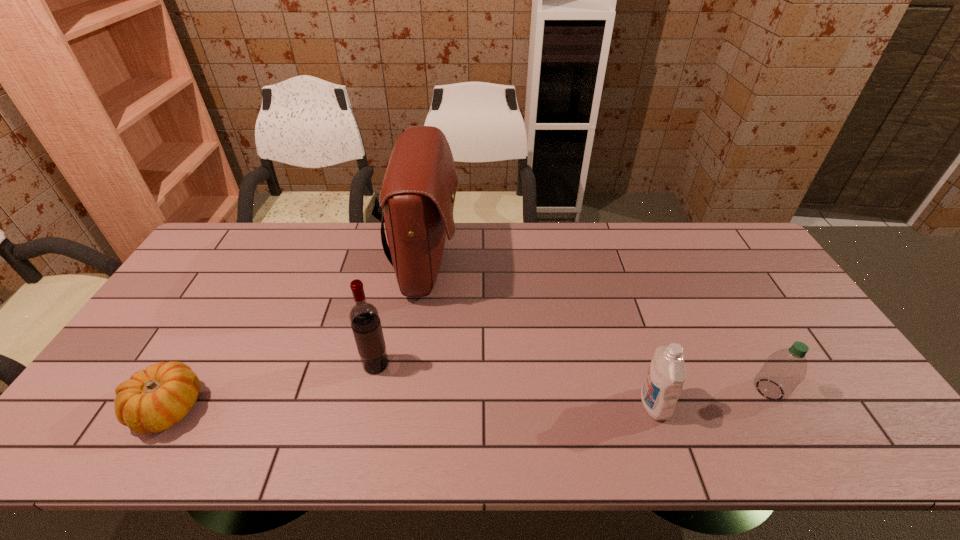
At what (x,y) coordinates should I click in order to perform the action: click on the tallest object. Please return your answer as a coordinate pair (x, y). Looking at the image, I should click on (417, 197).

Where is `satchel`? Image resolution: width=960 pixels, height=540 pixels. satchel is located at coordinates (417, 197).

Where is `wine bottle`? The width and height of the screenshot is (960, 540). wine bottle is located at coordinates (364, 318).

Image resolution: width=960 pixels, height=540 pixels. What are the coordinates of `detergent` in the screenshot? It's located at (666, 375).

Where is `the third tallest object`? This screenshot has height=540, width=960. the third tallest object is located at coordinates (666, 375).

At what (x,y) coordinates should I click in order to perform the action: click on the second shortest object. Please return your answer as a coordinate pair (x, y). Looking at the image, I should click on (783, 370).

Image resolution: width=960 pixels, height=540 pixels. In order to click on water bottle in this screenshot , I will do `click(783, 370)`.

The height and width of the screenshot is (540, 960). In order to click on gourd in this screenshot , I will do `click(153, 400)`.

Locate an element on the screen. the shortest object is located at coordinates (153, 400).

I want to click on vacant space located 0.340m on the open flap of the farthest object, so point(563,264).